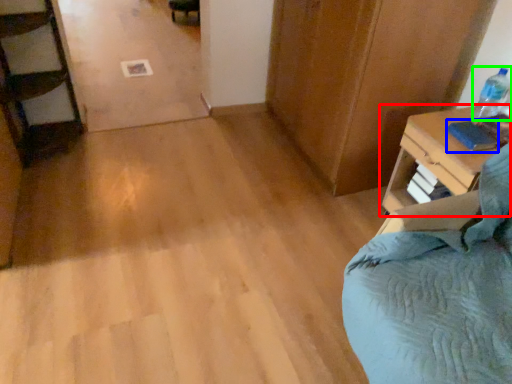
Question: Considering the real-world distances, which object is closest to nightstand (highlighted by a red box)? book (highlighted by a blue box) or bottle (highlighted by a green box).

Choices:
 (A) book
 (B) bottle

Answer: (A)